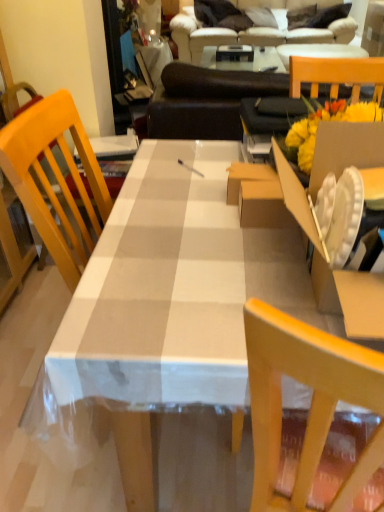
Where is `vacant space to the left of cardboard box at right`? vacant space to the left of cardboard box at right is located at coordinates (170, 279).